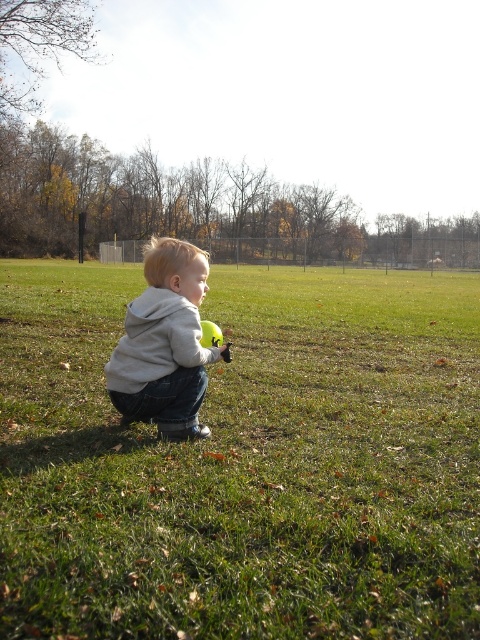
Does green grassy at center appear under light gray hoodie at center?

Incorrect, green grassy at center is not positioned below light gray hoodie at center.

Who is shorter, green grassy at center or light gray hoodie at center?

Standing shorter between the two is light gray hoodie at center.

Is point (156, 529) positioned before point (155, 288)?

Yes, point (156, 529) is closer to viewer.

Locate an element on the screen. The image size is (480, 640). green grassy at center is located at coordinates (244, 461).

Does point (144, 452) lie in front of point (206, 321)?

That is True.

Based on the photo, is green grassy at center to the right of yellow rubber ball at center from the viewer's perspective?

Indeed, green grassy at center is positioned on the right side of yellow rubber ball at center.

Locate an element on the screen. green grassy at center is located at coordinates (244, 461).

You are a GUI agent. You are given a task and a screenshot of the screen. Output one action in this format:
    pyautogui.click(x=<x>, y=<y>)
    Task: Click on the green grassy at center
    
    Given the screenshot: What is the action you would take?
    pyautogui.click(x=244, y=461)

Which is more to the left, light gray hoodie at center or yellow rubber ball at center?

Positioned to the left is light gray hoodie at center.

Who is taller, light gray hoodie at center or yellow rubber ball at center?

Standing taller between the two is light gray hoodie at center.

Identify the location of light gray hoodie at center. The width and height of the screenshot is (480, 640). (165, 344).